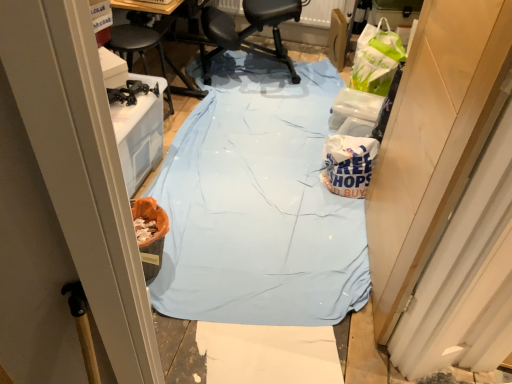
Question: From a real-world perspective, is white paper bag at center-right located higher than black leather chair at center?

Choices:
 (A) no
 (B) yes

Answer: (A)

Question: From the image's perspective, does white paper bag at center-right appear lower than black leather chair at center?

Choices:
 (A) no
 (B) yes

Answer: (B)

Question: Is the position of white paper bag at center-right less distant than that of black leather chair at center?

Choices:
 (A) no
 (B) yes

Answer: (B)

Question: From the image's perspective, is white paper bag at center-right above black leather chair at center?

Choices:
 (A) yes
 (B) no

Answer: (B)

Question: Does white paper bag at center-right have a smaller size compared to black leather chair at center?

Choices:
 (A) no
 (B) yes

Answer: (B)

Question: In terms of size, does wooden door at right appear bigger or smaller than light blue fabric at center?

Choices:
 (A) big
 (B) small

Answer: (B)

Question: Looking at their shapes, would you say wooden door at right is wider or thinner than light blue fabric at center?

Choices:
 (A) thin
 (B) wide

Answer: (A)

Question: Relative to light blue fabric at center, is wooden door at right in front or behind?

Choices:
 (A) front
 (B) behind

Answer: (A)

Question: Do you think wooden door at right is within light blue fabric at center, or outside of it?

Choices:
 (A) outside
 (B) inside

Answer: (A)

Question: Relative to light blue fabric at center, is white paper bag at center-right in front or behind?

Choices:
 (A) front
 (B) behind

Answer: (B)

Question: Considering the relative positions of white paper bag at center-right and light blue fabric at center in the image provided, is white paper bag at center-right to the left or to the right of light blue fabric at center?

Choices:
 (A) right
 (B) left

Answer: (A)

Question: Is white paper bag at center-right situated inside light blue fabric at center or outside?

Choices:
 (A) outside
 (B) inside

Answer: (A)

Question: From the image's perspective, is white paper bag at center-right positioned above or below light blue fabric at center?

Choices:
 (A) above
 (B) below

Answer: (B)

Question: Is point (370, 163) positioned closer to the camera than point (380, 327)?

Choices:
 (A) farther
 (B) closer

Answer: (A)

Question: Is white paper bag at center-right taller or shorter than wooden door at right?

Choices:
 (A) short
 (B) tall

Answer: (A)